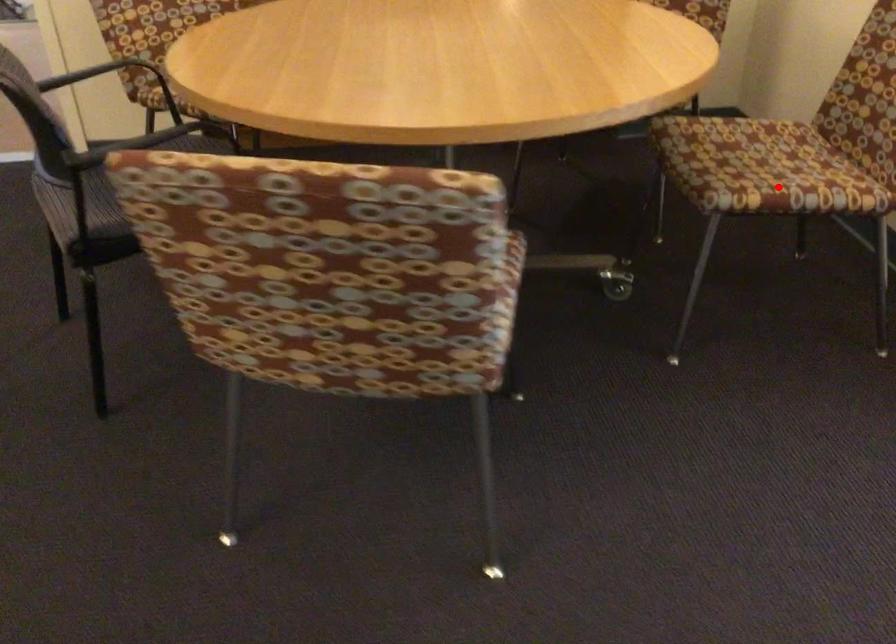
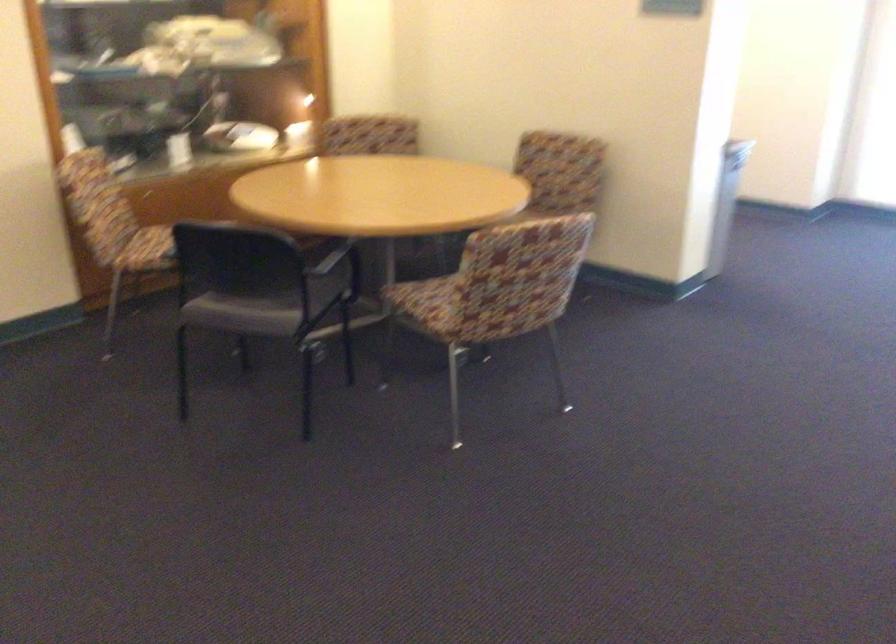
Question: I am providing you with two images of the same scene from different viewpoints. A red point is marked on the first image. Is the red point's position out of view in image 2?

Choices:
 (A) Yes
 (B) No

Answer: (A)